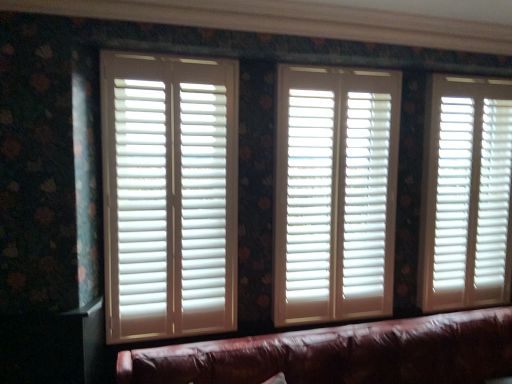
Question: In which direction should I rotate to look at white matte wood blinds at center, which ranks as the second window blind in right-to-left order?

Choices:
 (A) right
 (B) left

Answer: (A)

Question: Are white matte wood blinds at center, the second window blind in the left-to-right sequence, and white matte blinds at left, the first window blind in the left-to-right sequence, making contact?

Choices:
 (A) yes
 (B) no

Answer: (B)

Question: Is white matte wood blinds at center, the second window blind in the left-to-right sequence, in front of white matte blinds at left, the first window blind in the left-to-right sequence?

Choices:
 (A) no
 (B) yes

Answer: (A)

Question: Can you confirm if white matte wood blinds at center, the second window blind in the left-to-right sequence, is taller than white matte blinds at left, which appears as the third window blind when viewed from the right?

Choices:
 (A) no
 (B) yes

Answer: (B)

Question: Is white matte blinds at left, which appears as the third window blind when viewed from the right, surrounded by white matte wood blinds at center, the second window blind in the left-to-right sequence?

Choices:
 (A) yes
 (B) no

Answer: (B)

Question: Is white matte wood blinds at center, which ranks as the second window blind in right-to-left order, smaller than white matte blinds at left, which appears as the third window blind when viewed from the right?

Choices:
 (A) yes
 (B) no

Answer: (B)

Question: Does white matte wood blinds at center, which ranks as the second window blind in right-to-left order, have a lesser height compared to white matte blinds at left, which appears as the third window blind when viewed from the right?

Choices:
 (A) no
 (B) yes

Answer: (A)

Question: Is white matte blinds at right, which is the third window blind in left-to-right order, to the right of white matte blinds at left, which appears as the third window blind when viewed from the right, from the viewer's perspective?

Choices:
 (A) no
 (B) yes

Answer: (B)

Question: Is white matte blinds at right, which appears as the 1th window blind when viewed from the right, oriented away from white matte blinds at left, which appears as the third window blind when viewed from the right?

Choices:
 (A) no
 (B) yes

Answer: (A)

Question: Considering the relative sizes of white matte blinds at right, which appears as the 1th window blind when viewed from the right, and white matte blinds at left, the first window blind in the left-to-right sequence, in the image provided, is white matte blinds at right, which appears as the 1th window blind when viewed from the right, shorter than white matte blinds at left, the first window blind in the left-to-right sequence,?

Choices:
 (A) yes
 (B) no

Answer: (B)

Question: Does white matte blinds at right, which is the third window blind in left-to-right order, have a greater height compared to white matte blinds at left, which appears as the third window blind when viewed from the right?

Choices:
 (A) yes
 (B) no

Answer: (A)

Question: Is white matte blinds at right, which appears as the 1th window blind when viewed from the right, not close to white matte blinds at left, which appears as the third window blind when viewed from the right?

Choices:
 (A) yes
 (B) no

Answer: (A)

Question: Considering the relative sizes of white matte blinds at right, which appears as the 1th window blind when viewed from the right, and white matte blinds at left, the first window blind in the left-to-right sequence, in the image provided, is white matte blinds at right, which appears as the 1th window blind when viewed from the right, wider than white matte blinds at left, the first window blind in the left-to-right sequence,?

Choices:
 (A) no
 (B) yes

Answer: (B)

Question: Is the depth of white matte blinds at left, the first window blind in the left-to-right sequence, less than that of white matte blinds at right, which appears as the 1th window blind when viewed from the right?

Choices:
 (A) yes
 (B) no

Answer: (A)